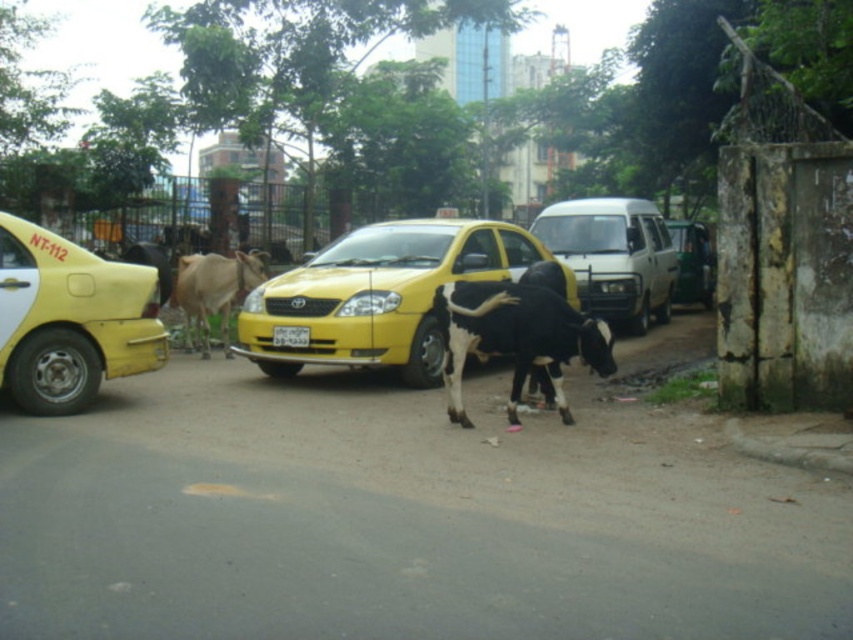
Who is higher up, black and white cow at center or white plastic license plate at center?

white plastic license plate at center

Is black and white cow at center taller than white plastic license plate at center?

Yes, black and white cow at center is taller than white plastic license plate at center.

Identify the location of black and white cow at center. (515, 337).

Can you confirm if white matte van at center is positioned to the left of metallic silver van at center?

Indeed, white matte van at center is positioned on the left side of metallic silver van at center.

Which is below, white matte van at center or metallic silver van at center?

white matte van at center is below.

Which is behind, point (640, 300) or point (708, 262)?

The point (708, 262) is more distant.

Identify the location of white matte van at center. (613, 257).

Who is positioned more to the right, black and white cow at center or white matte van at center?

From the viewer's perspective, white matte van at center appears more on the right side.

Between black and white cow at center and white matte van at center, which one has less height?

white matte van at center is shorter.

Which is behind, point (587, 326) or point (622, 280)?

Positioned behind is point (622, 280).

Where is `black and white cow at center`? black and white cow at center is located at coordinates (515, 337).